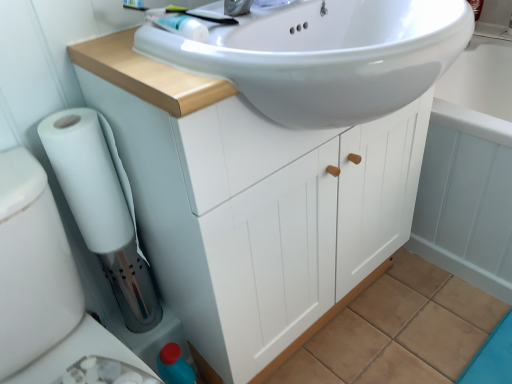
Question: Is point (26, 370) closer or farther from the camera than point (281, 48)?

Choices:
 (A) closer
 (B) farther

Answer: (B)

Question: From a real-world perspective, is blue plastic bidet at lower left, positioned as the first bidet in top-to-bottom order, physically located above or below white glossy sink at upper center?

Choices:
 (A) above
 (B) below

Answer: (B)

Question: Which is nearer to the white plastic bidet at lower left, acting as the 1th bidet starting from the bottom?

Choices:
 (A) blue plastic bidet at lower left, positioned as the first bidet in top-to-bottom order
 (B) white matte cabinet at center
 (C) white glossy sink at upper center
 (D) white glossy bath at center
 (E) white matte toilet paper at lower left

Answer: (A)

Question: Estimate the real-world distances between objects in this image. Which object is closer to the white glossy bath at center?

Choices:
 (A) white plastic bidet at lower left, which is counted as the 2th bidet, starting from the top
 (B) white glossy sink at upper center
 (C) blue plastic bidet at lower left, positioned as the first bidet in top-to-bottom order
 (D) white matte toilet paper at lower left
 (E) white matte cabinet at center

Answer: (E)